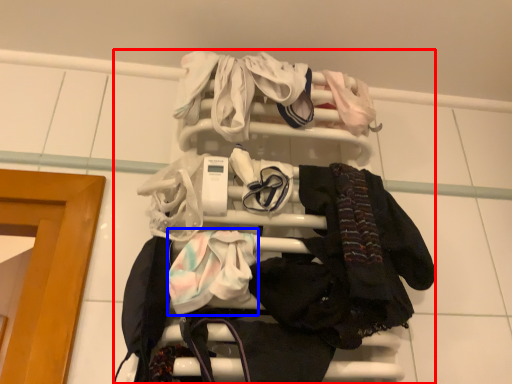
Question: Which object appears farthest to the camera in this image, bunk bed (highlighted by a red box) or baby clothe (highlighted by a blue box)?

Choices:
 (A) bunk bed
 (B) baby clothe

Answer: (A)